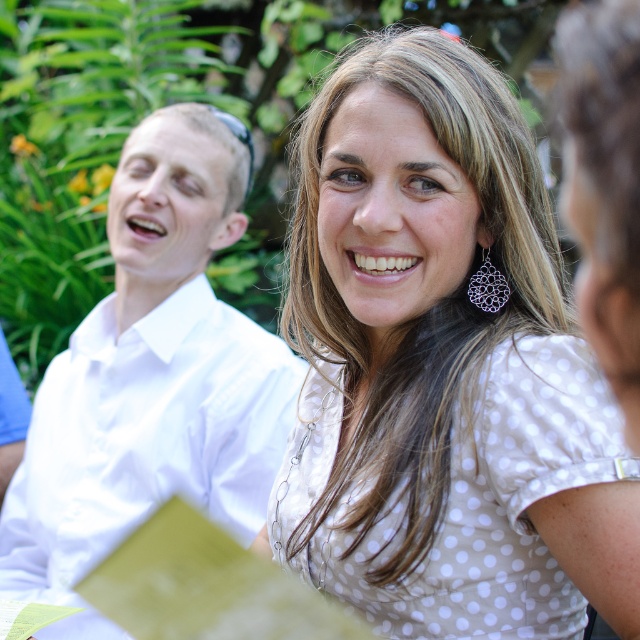
Question: Among these points, which one is farthest from the camera?

Choices:
 (A) (497, 300)
 (B) (236, 312)

Answer: (B)

Question: Which object appears farthest from the camera in this image?

Choices:
 (A) white dotted shirt at center
 (B) black textured earring at upper right
 (C) white smooth shirt at left

Answer: (C)

Question: Can you confirm if white dotted shirt at center is smaller than white smooth shirt at left?

Choices:
 (A) yes
 (B) no

Answer: (A)

Question: Which object appears closest to the camera in this image?

Choices:
 (A) white smooth shirt at left
 (B) black textured earring at upper right

Answer: (B)

Question: Is white dotted shirt at center further to camera compared to black textured earring at upper right?

Choices:
 (A) yes
 (B) no

Answer: (B)

Question: Can you confirm if white smooth shirt at left is positioned above black textured earring at upper right?

Choices:
 (A) yes
 (B) no

Answer: (B)